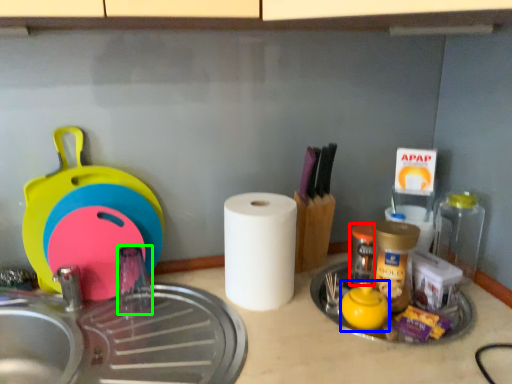
Question: Which object is the closest to the bottle (highlighted by a red box)? Choose among these: tea pot (highlighted by a blue box) or faucet (highlighted by a green box).

Choices:
 (A) tea pot
 (B) faucet

Answer: (A)